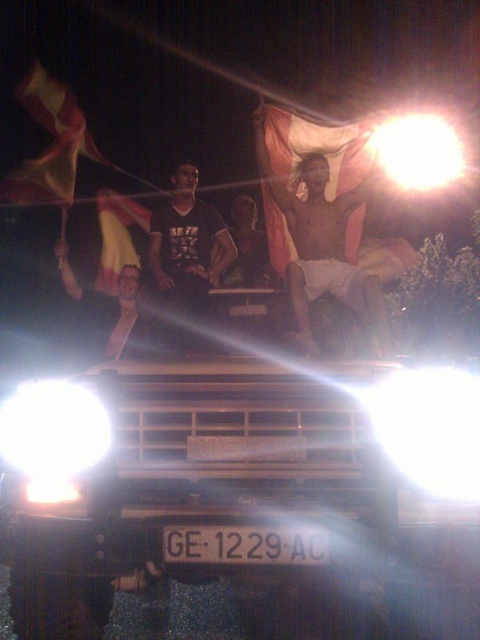
You are standing in front of the Nissan vehicle at night. There is a shiny metallic man at center. Where is the point at coordinate (323,244) located?

The point at coordinate (323,244) is located on the shiny metallic man at center.

You are a photographer standing 5 meters away from the shiny metallic man at center. Can you take a clear photo of him without moving closer?

The shiny metallic man at center is 4.50 meters away from the viewer. Since you are standing 5 meters away, you are farther than the required distance. To capture a clear photo, you need to move closer to within 4.50 meters.